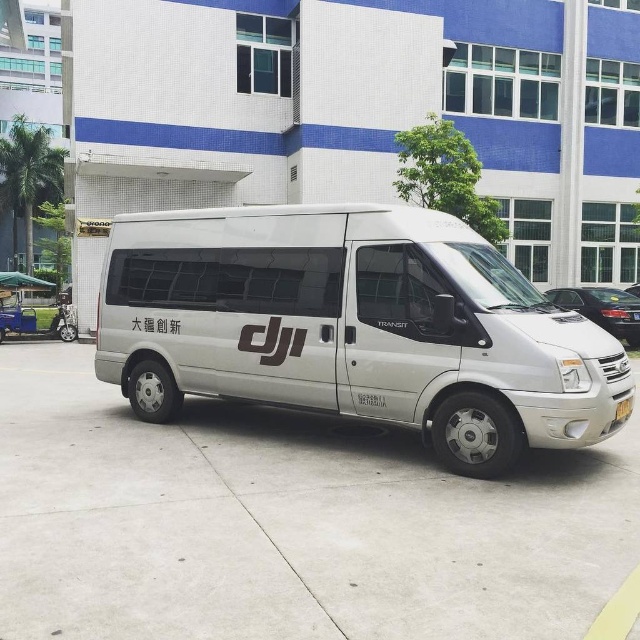
Is white concrete pavement at center taller than white metallic van at center?

No.

Which is below, white concrete pavement at center or white metallic van at center?

white concrete pavement at center is below.

The width and height of the screenshot is (640, 640). Identify the location of white concrete pavement at center. (285, 524).

Is point (284, 534) behind point (618, 605)?

Yes, point (284, 534) is farther from viewer.

Is white concrete pavement at center thinner than yellow rubber curb at lower right?

Incorrect, white concrete pavement at center's width is not less than yellow rubber curb at lower right's.

The width and height of the screenshot is (640, 640). What are the coordinates of `white concrete pavement at center` in the screenshot? It's located at (285, 524).

You are a GUI agent. You are given a task and a screenshot of the screen. Output one action in this format:
    pyautogui.click(x=<x>, y=<y>)
    Task: Click on the white concrete pavement at center
    
    Given the screenshot: What is the action you would take?
    pyautogui.click(x=285, y=524)

Identify the location of white metallic van at center. (353, 326).

Does white metallic van at center have a lesser width compared to yellow rubber curb at lower right?

Yes, white metallic van at center is thinner than yellow rubber curb at lower right.

Is point (320, 300) positioned before point (634, 600)?

No, (320, 300) is further to viewer.

Where is `white metallic van at center`? The image size is (640, 640). white metallic van at center is located at coordinates (353, 326).